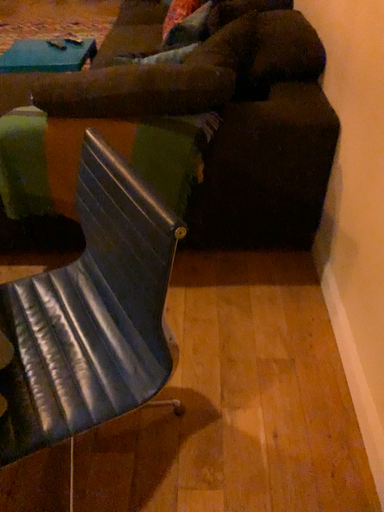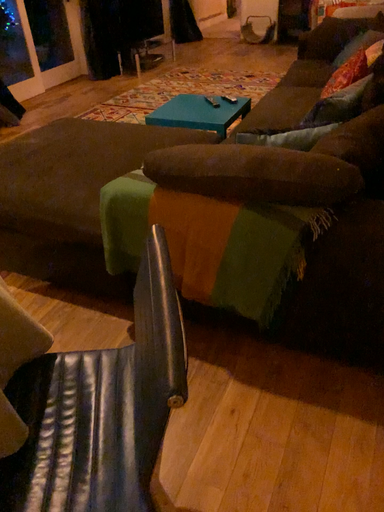
Question: Which way did the camera rotate in the video?

Choices:
 (A) rotated right
 (B) rotated left

Answer: (B)